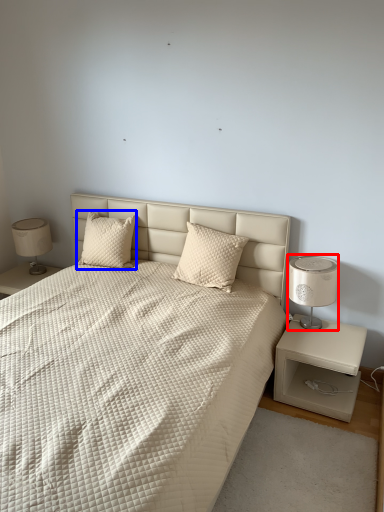
Question: Which object appears closest to the camera in this image, bedside lamp (highlighted by a red box) or pillow (highlighted by a blue box)?

Choices:
 (A) bedside lamp
 (B) pillow

Answer: (A)